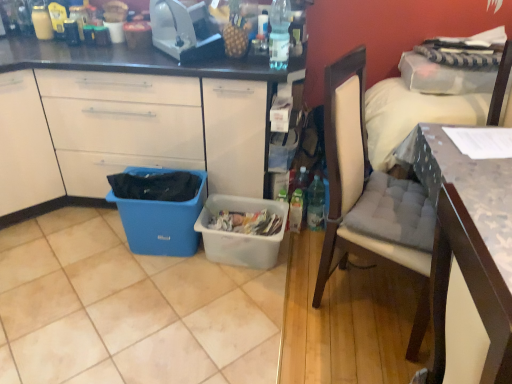
At what (x,y) coordinates should I click in order to perform the action: click on free point above blue plastic trash can at lower left (from a real-world perspective). Please return your answer as a coordinate pair (x, y). This screenshot has width=512, height=384. Looking at the image, I should click on (163, 181).